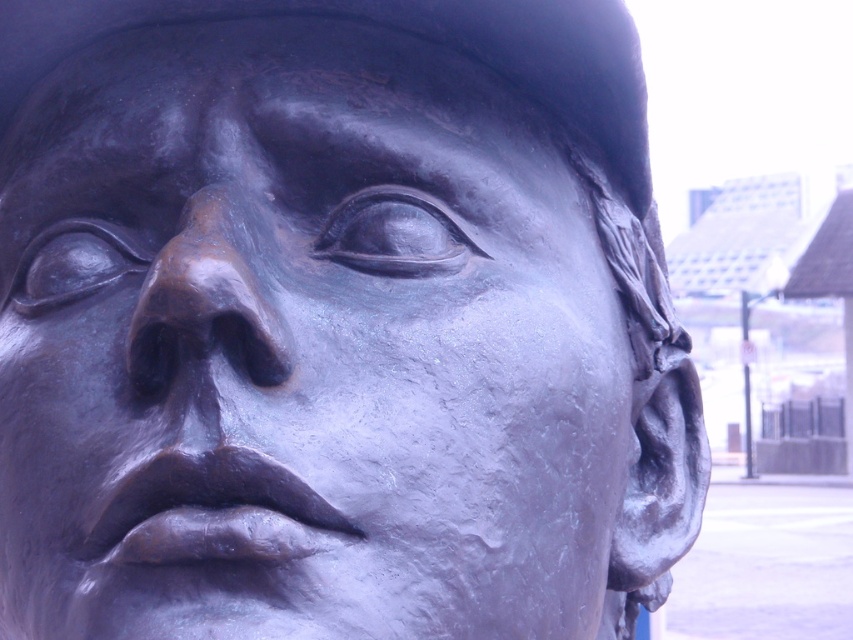
Question: Is bronze sculpture at center positioned behind bronze textured nose at center?

Choices:
 (A) yes
 (B) no

Answer: (B)

Question: Which object is farther from the camera taking this photo?

Choices:
 (A) bronze textured nose at center
 (B) bronze sculpture at center

Answer: (A)

Question: Is bronze sculpture at center further to camera compared to bronze textured nose at center?

Choices:
 (A) yes
 (B) no

Answer: (B)

Question: Observing the image, what is the correct spatial positioning of bronze sculpture at center in reference to bronze textured nose at center?

Choices:
 (A) right
 (B) left

Answer: (A)